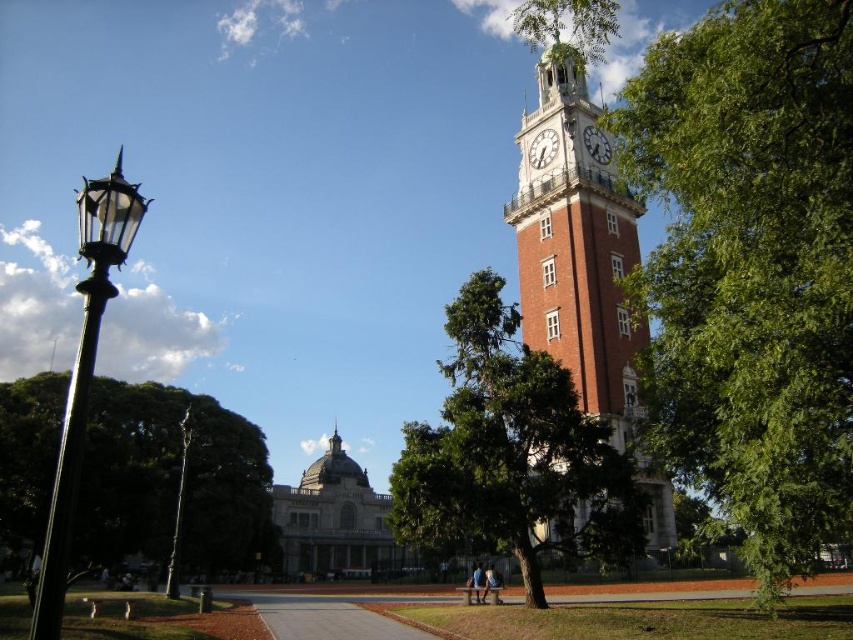
Question: Which of the following is the closest to the observer?

Choices:
 (A) (535, 161)
 (B) (527, 156)
 (C) (764, 140)
 (D) (138, 205)

Answer: (D)

Question: Is the position of brick clock tower at center right more distant than that of white metallic clock at upper right?

Choices:
 (A) no
 (B) yes

Answer: (A)

Question: Which is farther from the blue fabric shirt at lower center?

Choices:
 (A) brick clock tower at center right
 (B) green leafy tree at center

Answer: (A)

Question: Is green leafy tree at right thinner than blue fabric shirt at lower center?

Choices:
 (A) yes
 (B) no

Answer: (B)

Question: Does black glass lamp post at left appear on the right side of polished brass lamp post at left?

Choices:
 (A) yes
 (B) no

Answer: (B)

Question: Which point is farther to the camera?

Choices:
 (A) brick clock tower at center right
 (B) white painted metal clock at upper right
 (C) blue fabric shirt at lower center

Answer: (B)